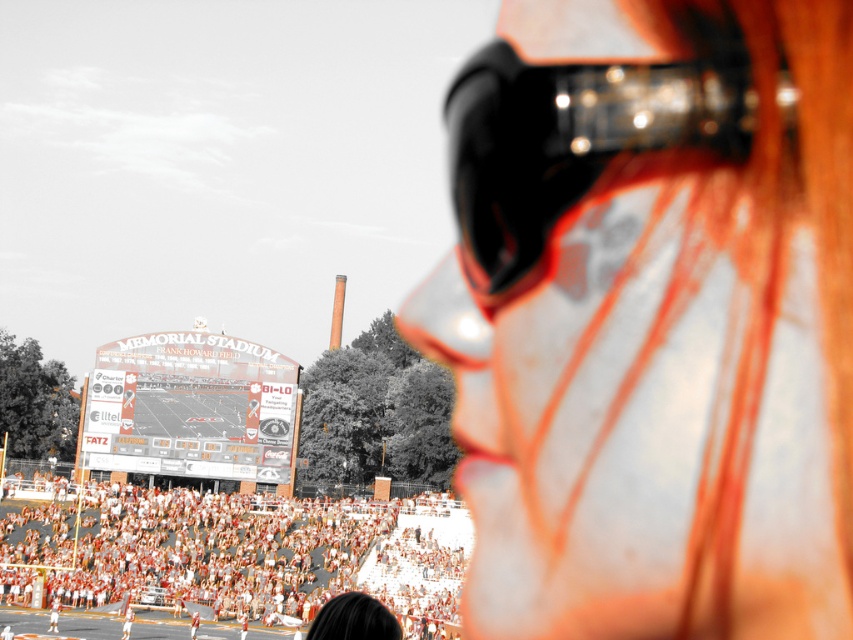
Question: Which point appears closest to the camera in this image?

Choices:
 (A) (277, 595)
 (B) (825, 352)
 (C) (676, 145)

Answer: (B)

Question: Is matte orange helmet at center thinner than white fabric crowd at lower center?

Choices:
 (A) no
 (B) yes

Answer: (B)

Question: Which object is closer to the camera taking this photo?

Choices:
 (A) matte orange helmet at center
 (B) white fabric crowd at lower center

Answer: (A)

Question: Is matte orange helmet at center thinner than black glossy goggles at upper right?

Choices:
 (A) no
 (B) yes

Answer: (A)

Question: Does matte orange helmet at center lie in front of white fabric crowd at lower center?

Choices:
 (A) yes
 (B) no

Answer: (A)

Question: Among these objects, which one is nearest to the camera?

Choices:
 (A) matte orange helmet at center
 (B) black glossy goggles at upper right
 (C) white fabric crowd at lower center

Answer: (A)